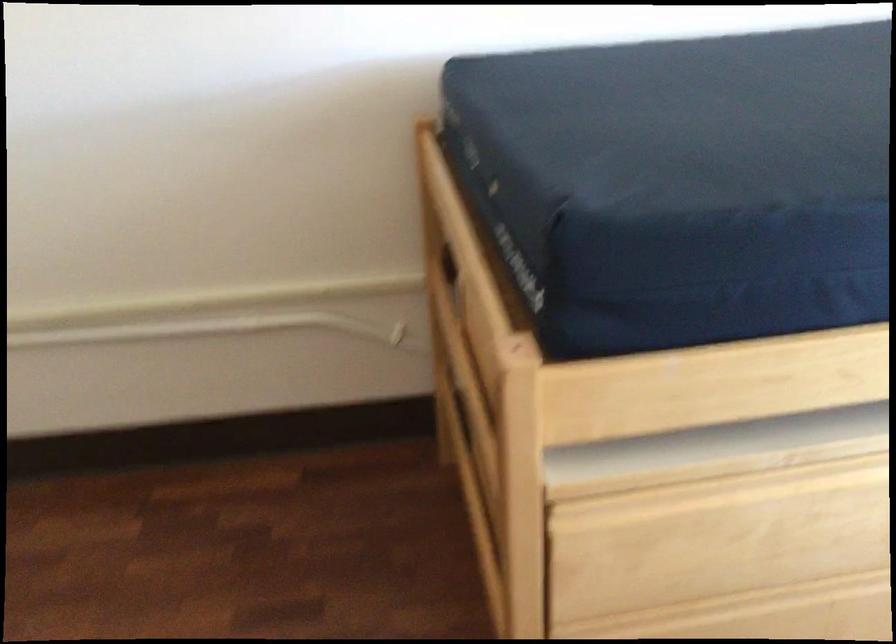
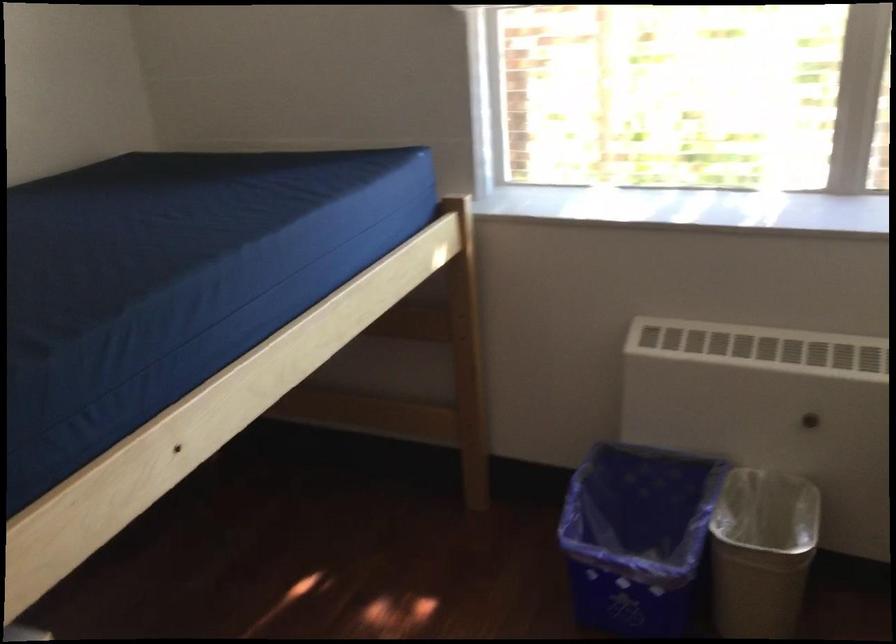
Question: The camera is either moving clockwise (left) or counter-clockwise (right) around the object. The first image is from the beginning of the video and the second image is from the end. Is the camera moving left or right when shooting the video?

Choices:
 (A) Left
 (B) Right

Answer: (A)